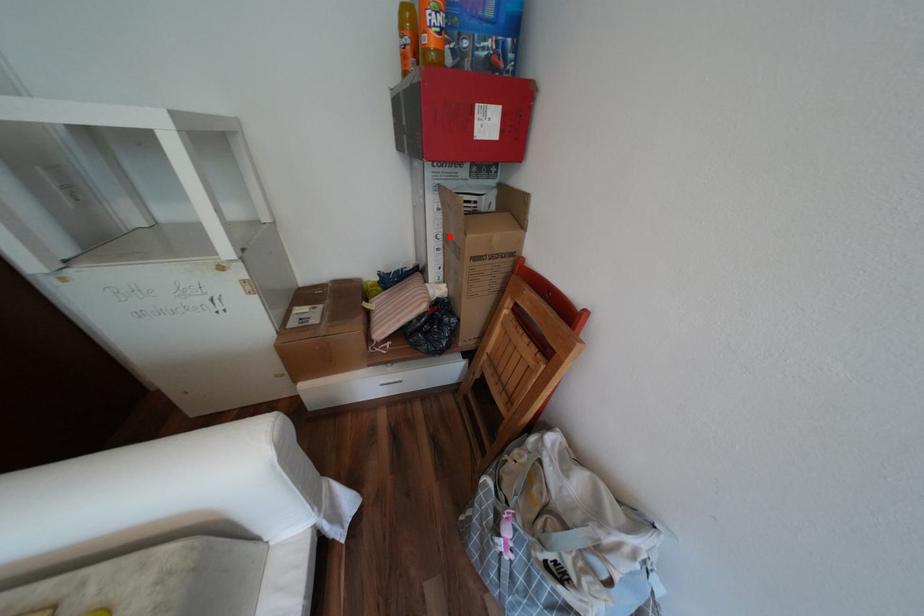
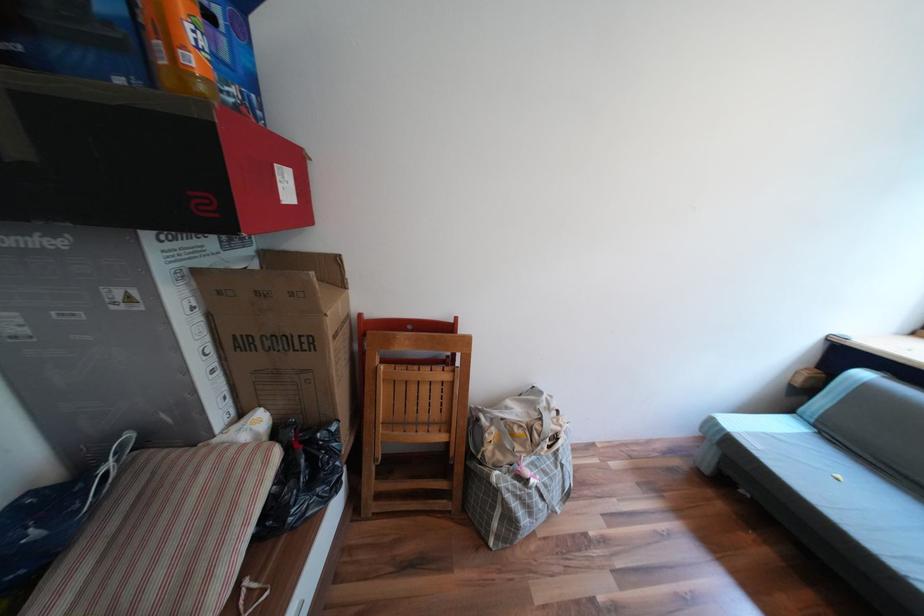
Locate, in the second image, the point that corresponds to the highlighted location in the first image.

(219, 349)